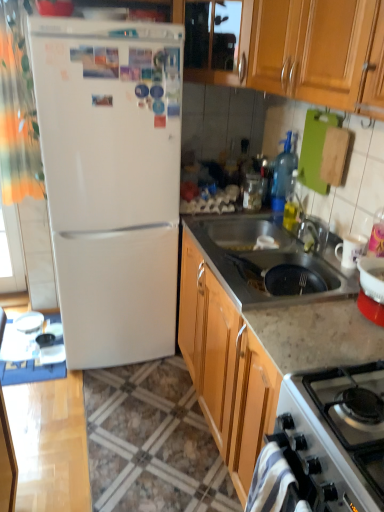
Identify the location of transparent glass jar at upper center. (252, 192).

Measure the distance between point (363, 454) and camera.

Point (363, 454) is 34.96 inches away from camera.

Measure the distance between white glossy gas stove at lower right and camera.

A distance of 30.57 inches exists between white glossy gas stove at lower right and camera.

Image resolution: width=384 pixels, height=512 pixels. I want to click on white glossy refrigerator at left, so click(x=111, y=181).

Locate an element on the screen. The width and height of the screenshot is (384, 512). orange fabric curtain at left is located at coordinates (17, 111).

This screenshot has height=512, width=384. Identify the location of transparent glass jar at upper center. (252, 192).

Find the location of `refrigerator below the orange fabric curtain at left (from a real-world perspective)`. refrigerator below the orange fabric curtain at left (from a real-world perspective) is located at coordinates (111, 181).

Consider the image. From the image's perspective, which is below, white glossy refrigerator at left or orange fabric curtain at left?

white glossy refrigerator at left appears lower in the image.

Between white glossy refrigerator at left and orange fabric curtain at left, which one appears on the left side from the viewer's perspective?

orange fabric curtain at left.

Is white glossy refrigerator at left located outside orange fabric curtain at left?

Indeed, white glossy refrigerator at left is completely outside orange fabric curtain at left.

Is transparent glass jar at upper center turned away from marble countertop at lower right?

No, transparent glass jar at upper center's orientation is not away from marble countertop at lower right.

You are a GUI agent. You are given a task and a screenshot of the screen. Output one action in this format:
    pyautogui.click(x=<x>, y=<y>)
    Task: Click on the granite below the transparent glass jar at upper center (from a real-world perspective)
    
    Given the screenshot: What is the action you would take?
    pyautogui.click(x=152, y=442)

From a real-world perspective, does transparent glass jar at upper center sit lower than marble countertop at lower right?

No.

Consider the image. Are white glossy refrigerator at left and white glossy gas stove at lower right far apart?

Absolutely, white glossy refrigerator at left is distant from white glossy gas stove at lower right.

Considering the relative sizes of white glossy refrigerator at left and white glossy gas stove at lower right in the image provided, is white glossy refrigerator at left bigger than white glossy gas stove at lower right?

Correct, white glossy refrigerator at left is larger in size than white glossy gas stove at lower right.

Is white glossy gas stove at lower right located within white glossy refrigerator at left?

That's incorrect, white glossy gas stove at lower right is not inside white glossy refrigerator at left.

How many degrees apart are the facing directions of white glossy gas stove at lower right and stainless steel sink at lower center?

0.000262 degrees separate the facing orientations of white glossy gas stove at lower right and stainless steel sink at lower center.

Which is behind, point (349, 437) or point (319, 271)?

Positioned behind is point (319, 271).

Is white glossy gas stove at lower right taller or shorter than stainless steel sink at lower center?

white glossy gas stove at lower right is taller than stainless steel sink at lower center.

Can you confirm if orange fabric curtain at left is smaller than transparent glass jar at upper center?

No.

Identify the location of curtain located in front of the transparent glass jar at upper center. The width and height of the screenshot is (384, 512). (17, 111).

Is orange fabric curtain at left surrounding transparent glass jar at upper center?

Definitely not — transparent glass jar at upper center is not inside orange fabric curtain at left.

Is point (6, 98) behind point (245, 186)?

No.

From the image's perspective, relative to orange fabric curtain at left, is stainless steel sink at lower center above or below?

stainless steel sink at lower center is below orange fabric curtain at left.

From a real-world perspective, is stainless steel sink at lower center under orange fabric curtain at left?

Correct, in the physical world, stainless steel sink at lower center is lower than orange fabric curtain at left.

Where is `curtain behind the stainless steel sink at lower center`? curtain behind the stainless steel sink at lower center is located at coordinates (17, 111).

Consider the image. Which object is positioned more to the left, orange fabric curtain at left or white glossy refrigerator at left?

Positioned to the left is orange fabric curtain at left.

I want to click on curtain positioned vertically above the white glossy refrigerator at left (from a real-world perspective), so click(x=17, y=111).

Would you say orange fabric curtain at left is outside white glossy refrigerator at left?

orange fabric curtain at left lies outside white glossy refrigerator at left's area.

How different are the orientations of orange fabric curtain at left and white glossy refrigerator at left in degrees?

0.000707 degrees.

This screenshot has width=384, height=512. I want to click on refrigerator located in front of the orange fabric curtain at left, so click(111, 181).

In order to click on appliance above the marble countertop at lower right (from a real-world perspective) in this screenshot , I will do `click(252, 192)`.

Considering their positions, is stainless steel sink at lower center positioned further to white glossy gas stove at lower right than white glossy refrigerator at left?

white glossy refrigerator at left is further to white glossy gas stove at lower right.

Estimate the real-world distances between objects in this image. Which object is closer to white glossy refrigerator at left, orange fabric curtain at left or marble countertop at lower right?

Answer: Based on the image, orange fabric curtain at left appears to be nearer to white glossy refrigerator at left.

From the picture: Considering their positions, is marble countertop at lower right positioned further to white glossy gas stove at lower right than orange fabric curtain at left?

orange fabric curtain at left.

Looking at the image, which one is located further to orange fabric curtain at left, white glossy refrigerator at left or transparent glass jar at upper center?

transparent glass jar at upper center is positioned further to the anchor orange fabric curtain at left.

Looking at the image, which one is located closer to orange fabric curtain at left, stainless steel sink at lower center or white glossy refrigerator at left?

Based on the image, white glossy refrigerator at left appears to be nearer to orange fabric curtain at left.

Estimate the real-world distances between objects in this image. Which object is further from transparent glass jar at upper center, stainless steel sink at lower center or orange fabric curtain at left?

orange fabric curtain at left is further to transparent glass jar at upper center.

Looking at the image, which one is located closer to stainless steel sink at lower center, transparent glass jar at upper center or white glossy gas stove at lower right?

Among the two, transparent glass jar at upper center is located nearer to stainless steel sink at lower center.

Estimate the real-world distances between objects in this image. Which object is closer to marble countertop at lower right, white glossy gas stove at lower right or transparent glass jar at upper center?

Based on the image, white glossy gas stove at lower right appears to be nearer to marble countertop at lower right.

Where is `curtain located between white glossy gas stove at lower right and transparent glass jar at upper center in the depth direction`? The image size is (384, 512). curtain located between white glossy gas stove at lower right and transparent glass jar at upper center in the depth direction is located at coordinates tap(17, 111).

What are the coordinates of `sink between white glossy gas stove at lower right and transparent glass jar at upper center in the front-back direction` in the screenshot? It's located at (265, 262).

You are a GUI agent. You are given a task and a screenshot of the screen. Output one action in this format:
    pyautogui.click(x=<x>, y=<y>)
    Task: Click on the sink between white glossy refrigerator at left and marble countertop at lower right in the up-down direction
    The width and height of the screenshot is (384, 512).
    Given the screenshot: What is the action you would take?
    pyautogui.click(x=265, y=262)

The width and height of the screenshot is (384, 512). I want to click on refrigerator between orange fabric curtain at left and marble countertop at lower right vertically, so click(x=111, y=181).